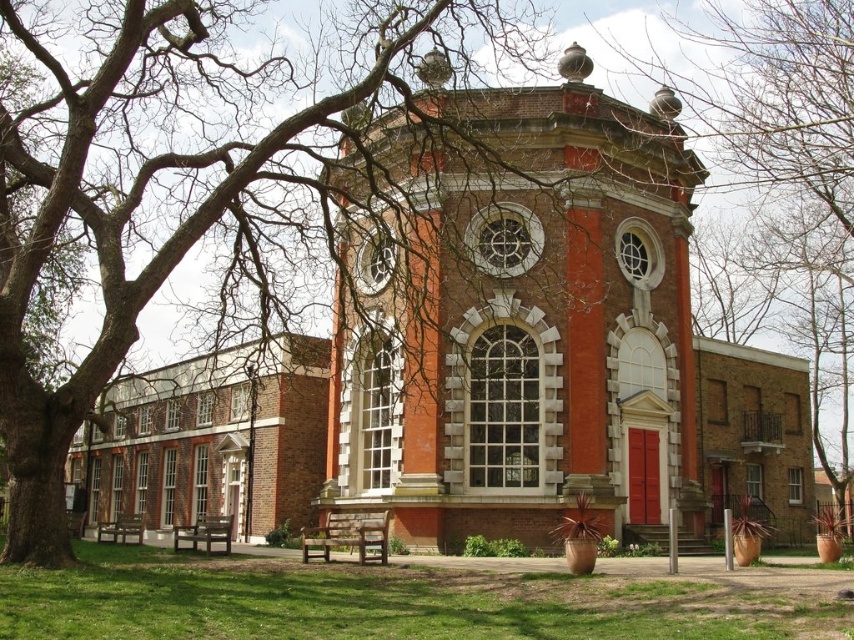
You are standing in front of the historic building and notice two sets of bare branches in the image. Which set of branches, the bare branches at upper left or the bare branches at center, appears closer to you?

The bare branches at upper left appears closer because it is in front of the bare branches at center.

You are standing in front of the historic Georgian building and want to take a photo. There are two points marked on the building, point 1 at coordinates point (266, 282) and point 2 at coordinates point (835, 236). Which point is closer to your camera when taking the photo?

Point (266, 282) is closer to the camera than point (835, 236).

You are an architect analyzing the symmetry of the historic building. You notice two sets of bare branches in the image. Which set of branches, the bare branches at upper left or the bare branches at center, is bigger in size?

The bare branches at upper left is larger in size than the bare branches at center.